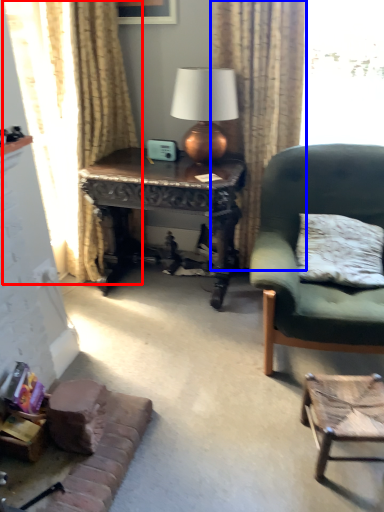
Question: Which of the following is the closest to the observer, curtain (highlighted by a red box) or curtain (highlighted by a blue box)?

Choices:
 (A) curtain
 (B) curtain

Answer: (A)